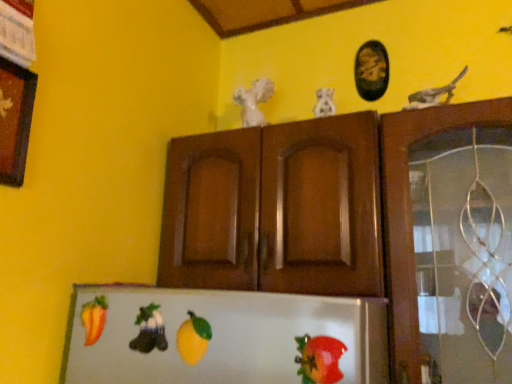
Question: Considering the relative sizes of black oval frame at upper center, which ranks as the 2th picture frame in left-to-right order, and yellow matte lemon at center, marked as the 1th fruit in a front-to-back arrangement, in the image provided, is black oval frame at upper center, which ranks as the 2th picture frame in left-to-right order, wider than yellow matte lemon at center, marked as the 1th fruit in a front-to-back arrangement,?

Choices:
 (A) yes
 (B) no

Answer: (A)

Question: From the image's perspective, is black oval frame at upper center, positioned as the second picture frame in front-to-back order, over yellow matte lemon at center, which is the 1th fruit from right to left?

Choices:
 (A) no
 (B) yes

Answer: (B)

Question: Would you say black oval frame at upper center, which ranks as the first picture frame in right-to-left order, is outside yellow matte lemon at center, marked as the 1th fruit in a front-to-back arrangement?

Choices:
 (A) no
 (B) yes

Answer: (B)

Question: Can you confirm if black oval frame at upper center, which ranks as the 2th picture frame in left-to-right order, is positioned to the right of yellow matte lemon at center, marked as the 1th fruit in a front-to-back arrangement?

Choices:
 (A) yes
 (B) no

Answer: (A)

Question: Is black oval frame at upper center, which ranks as the first picture frame in right-to-left order, smaller than yellow matte lemon at center, the second fruit from the left?

Choices:
 (A) no
 (B) yes

Answer: (A)

Question: Considering the positions of brown glossy cabinet doors at center and wooden picture frame at upper left, which is the 2th picture frame from top to bottom, in the image, is brown glossy cabinet doors at center wider or thinner than wooden picture frame at upper left, which is the 2th picture frame from top to bottom,?

Choices:
 (A) thin
 (B) wide

Answer: (B)

Question: In the image, is brown glossy cabinet doors at center on the left side or the right side of wooden picture frame at upper left, positioned as the 1th picture frame in left-to-right order?

Choices:
 (A) right
 (B) left

Answer: (A)

Question: From a real-world perspective, is brown glossy cabinet doors at center positioned above or below wooden picture frame at upper left, marked as the first picture frame in a front-to-back arrangement?

Choices:
 (A) above
 (B) below

Answer: (B)

Question: Is brown glossy cabinet doors at center bigger or smaller than wooden picture frame at upper left, the second picture frame from the back?

Choices:
 (A) small
 (B) big

Answer: (B)

Question: Is point (144, 347) closer or farther from the camera than point (304, 336)?

Choices:
 (A) closer
 (B) farther

Answer: (B)

Question: Considering the positions of green felt boot at lower center, the 3th animal viewed from the back, and shiny plastic tomato at lower right in the image, is green felt boot at lower center, the 3th animal viewed from the back, wider or thinner than shiny plastic tomato at lower right?

Choices:
 (A) wide
 (B) thin

Answer: (A)

Question: From a real-world perspective, is green felt boot at lower center, which appears as the 3th animal when viewed from the top, positioned above or below shiny plastic tomato at lower right?

Choices:
 (A) below
 (B) above

Answer: (B)

Question: From the image's perspective, is green felt boot at lower center, which is the first animal in left-to-right order, positioned above or below shiny plastic tomato at lower right?

Choices:
 (A) below
 (B) above

Answer: (B)

Question: Considering the positions of shiny plastic tomato at lower right and wooden picture frame at upper left, positioned as the 1th picture frame in left-to-right order, in the image, is shiny plastic tomato at lower right bigger or smaller than wooden picture frame at upper left, positioned as the 1th picture frame in left-to-right order,?

Choices:
 (A) small
 (B) big

Answer: (A)

Question: Is shiny plastic tomato at lower right in front of or behind wooden picture frame at upper left, which is the 2th picture frame from top to bottom, in the image?

Choices:
 (A) behind
 (B) front

Answer: (B)